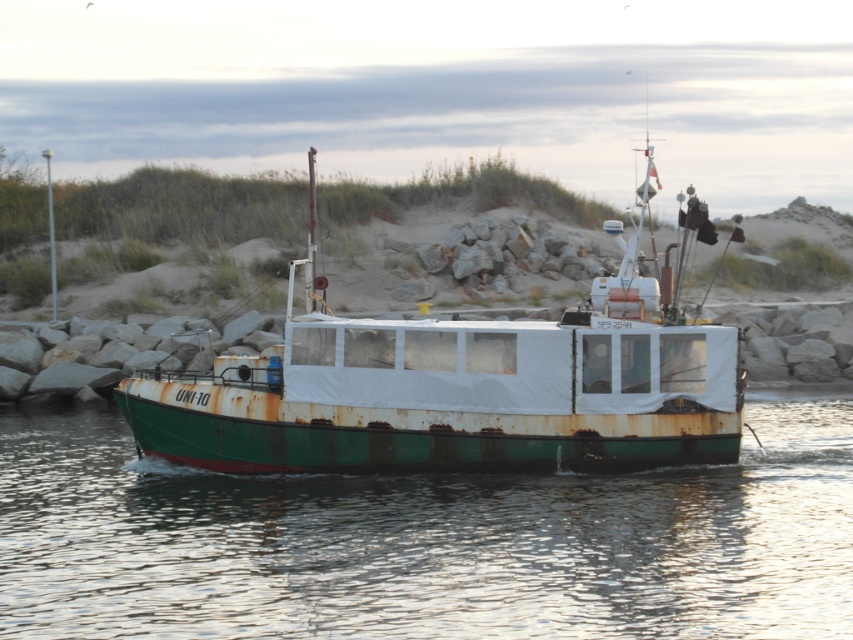
Can you confirm if green rusty water at center is taller than rusty metal boat at center?

In fact, green rusty water at center may be shorter than rusty metal boat at center.

Between point (782, 465) and point (546, 384), which one is positioned behind?

The point (782, 465) is more distant.

This screenshot has width=853, height=640. Identify the location of green rusty water at center. (425, 544).